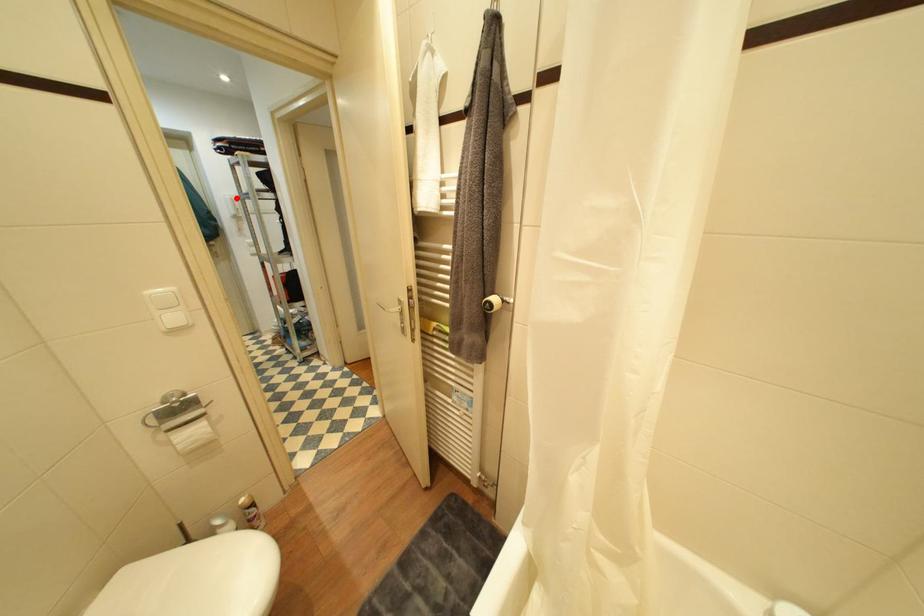
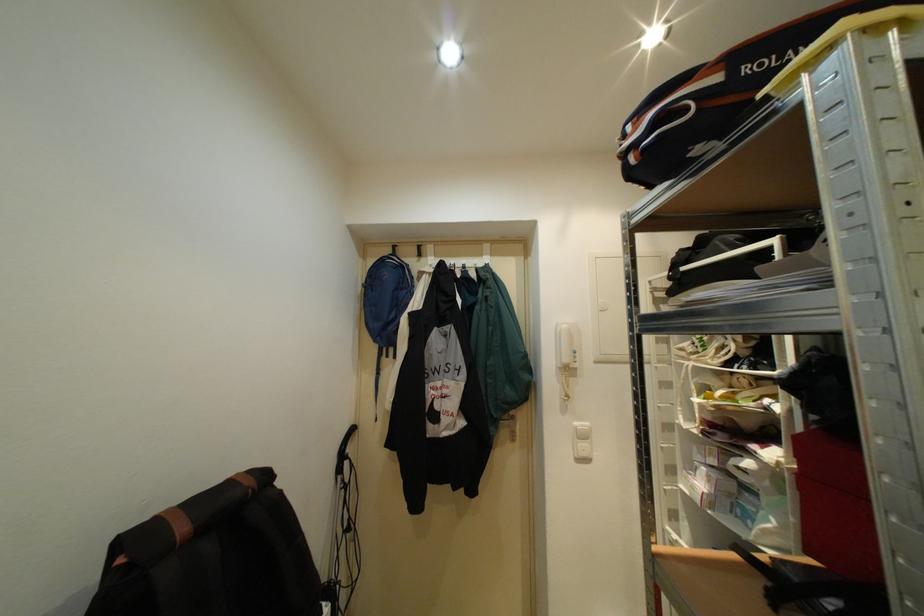
Locate, in the second image, the point that corresponds to the highlighted location in the first image.

(573, 328)